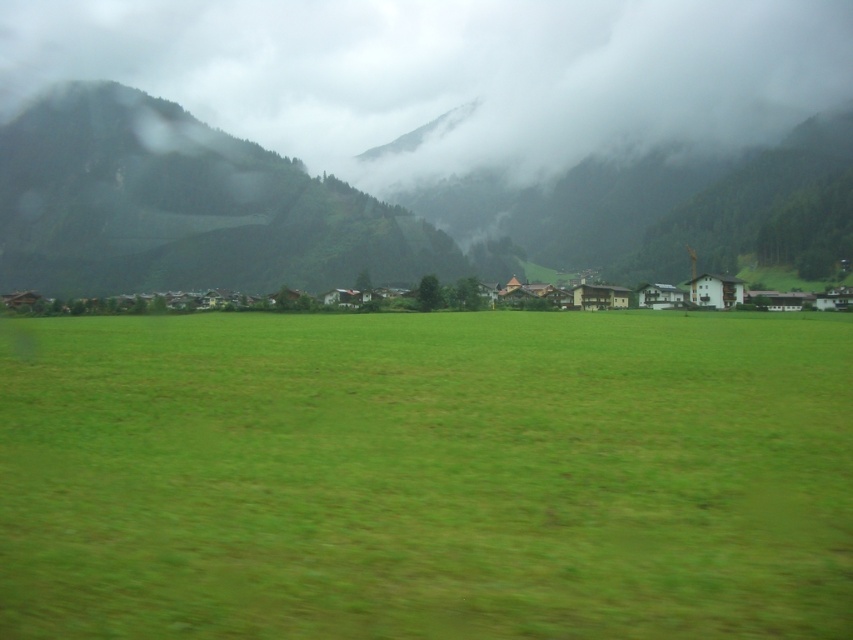
You are standing at the edge of the green grassy field at center and want to walk towards the green forested mountain at upper left. What will you notice about their heights as you move closer?

The green grassy field at center has a lesser height compared to the green forested mountain at upper left, so as you approach the mountain, you will notice that the mountain rises higher above the field.

You are standing in the middle of the green grassy field at center and want to walk towards the white wooden houses at center. Which direction should you walk to get closer to the houses?

Since the green grassy field at center is closer to the viewer than the white wooden houses at center, you should walk forward towards the houses as they are further away in the background.